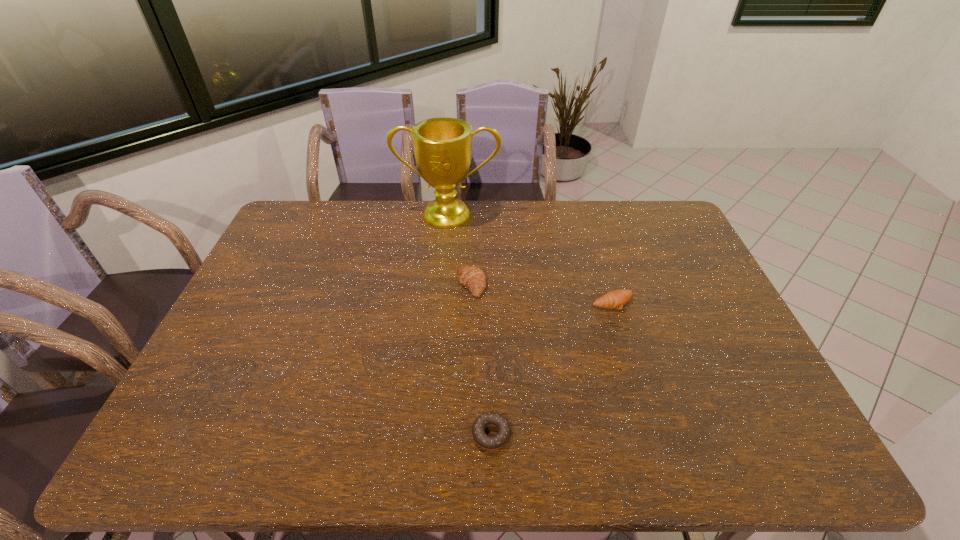
At what (x,y) coordinates should I click in order to perform the action: click on free spot between the doughnut and the shorter crescent roll. Please return your answer as a coordinate pair (x, y). Looking at the image, I should click on (552, 368).

Locate an element on the screen. This screenshot has width=960, height=540. empty space that is in between the taller crescent roll and the rightmost object is located at coordinates (542, 294).

Locate an element on the screen. free space between the shortest object and the award is located at coordinates (469, 325).

Identify the location of unoccupied area between the farthest object and the right crescent roll. (531, 259).

You are a GUI agent. You are given a task and a screenshot of the screen. Output one action in this format:
    pyautogui.click(x=<x>, y=<y>)
    Task: Click on the free space between the nearest object and the right crescent roll
    This screenshot has width=960, height=540.
    Given the screenshot: What is the action you would take?
    pyautogui.click(x=552, y=368)

Find the location of a particular element. Image resolution: width=960 pixels, height=540 pixels. free space that is in between the shortest object and the taller crescent roll is located at coordinates (481, 360).

Locate an element on the screen. This screenshot has width=960, height=540. vacant area that lies between the award and the left crescent roll is located at coordinates (460, 250).

The width and height of the screenshot is (960, 540). Identify the location of blank region between the shortest object and the shorter crescent roll. (552, 368).

The image size is (960, 540). In order to click on vacant space that is in between the right crescent roll and the farthest object in this screenshot , I will do `click(531, 259)`.

Identify which object is the third nearest to the farthest object. Please provide its 2D coordinates. Your answer should be formatted as a tuple, i.e. [(x, y)], where the tuple contains the x and y coordinates of a point satisfying the conditions above.

[(490, 443)]